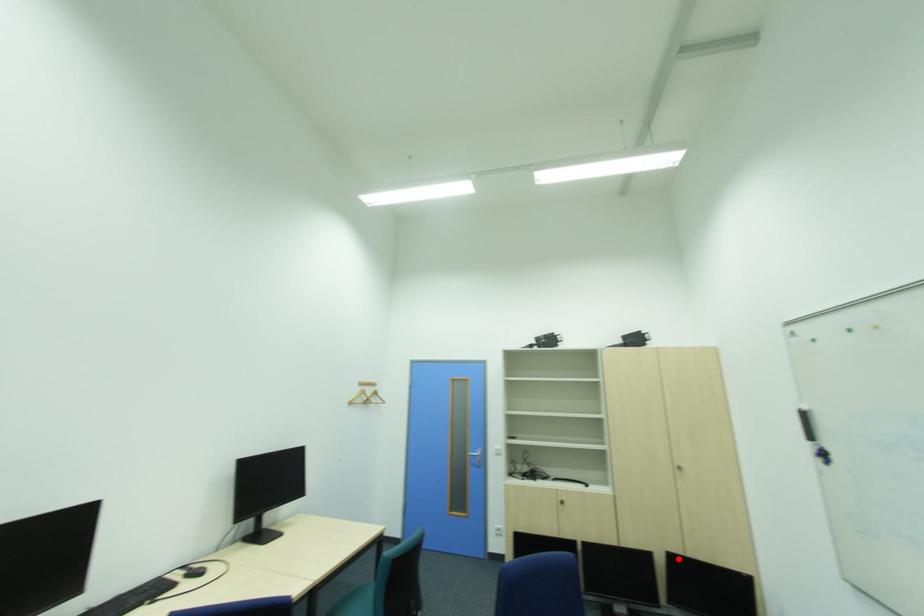
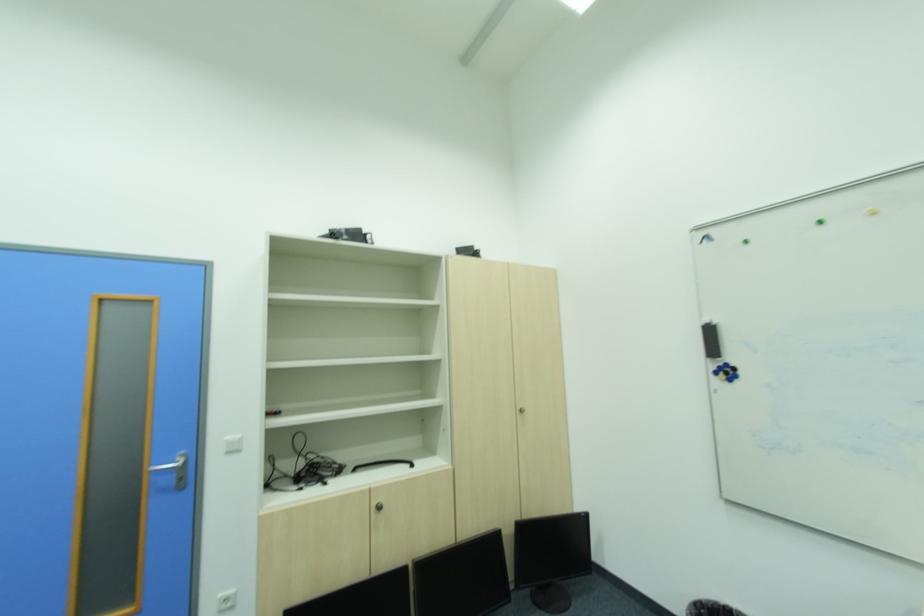
Question: I am providing you with two images of the same scene from different viewpoints. A red point is shown in image1. For the corresponding object point in image2, is it positioned nearer or farther from the camera?

Choices:
 (A) Nearer
 (B) Farther

Answer: (B)